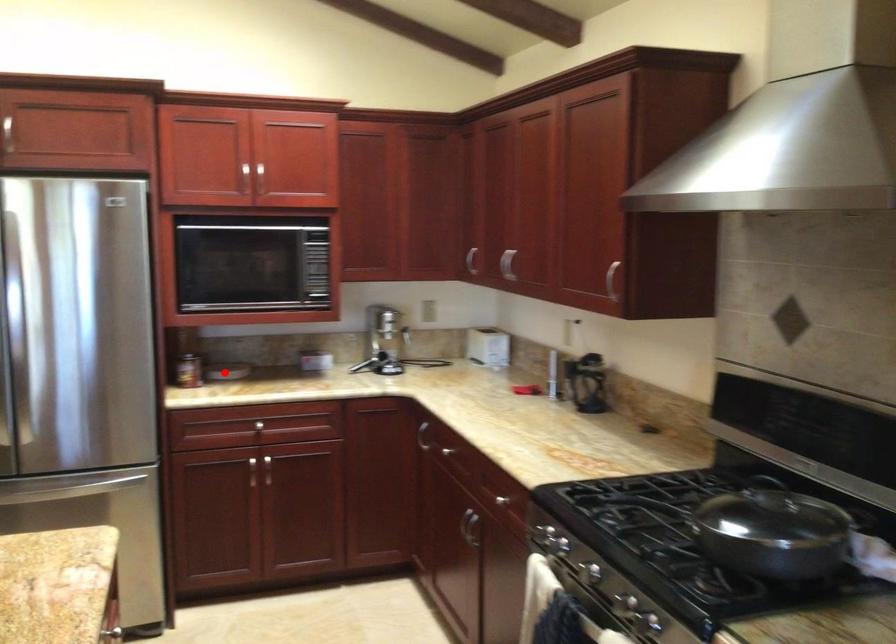
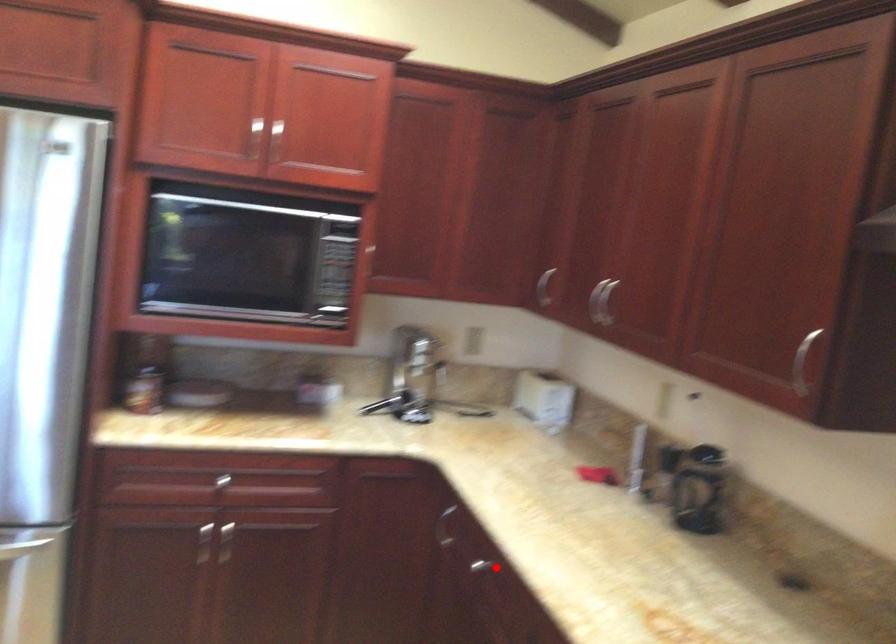
I am providing you with two images of the same scene from different viewpoints. A red point is marked on the first image and another point is marked on the second image. Are the points marked in image1 and image2 representing the same 3D position?

No